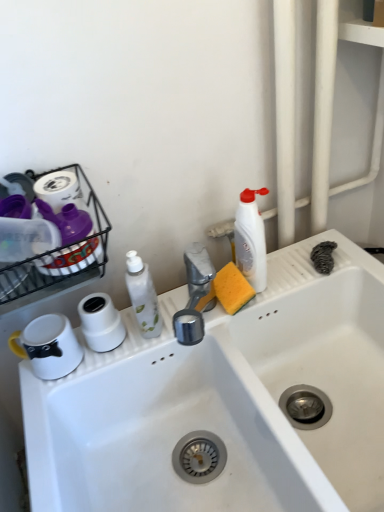
Image resolution: width=384 pixels, height=512 pixels. What do you see at coordinates (225, 401) in the screenshot?
I see `white glossy sink at center` at bounding box center [225, 401].

What are the coordinates of `white glossy mug at left` in the screenshot? It's located at pos(48,346).

The image size is (384, 512). What do you see at coordinates (251, 239) in the screenshot? I see `white plastic bottle at upper right, which is the first cleaning product in right-to-left order` at bounding box center [251, 239].

This screenshot has width=384, height=512. Describe the element at coordinates (101, 322) in the screenshot. I see `white matte toilet paper at center` at that location.

Measure the distance between white glossy bottle at center, which is the 2th cleaning product from right to left, and camera.

white glossy bottle at center, which is the 2th cleaning product from right to left, and camera are 32.55 inches apart.

Identify the location of white glossy sink at center. Image resolution: width=384 pixels, height=512 pixels. (225, 401).

Considering the sizes of objects white matte toilet paper at center and white glossy sink at center in the image provided, who is bigger, white matte toilet paper at center or white glossy sink at center?

white glossy sink at center is bigger.

Is the depth of white matte toilet paper at center greater than that of white glossy sink at center?

Yes, white matte toilet paper at center is further from the viewer.

Find the location of a particular element. The width and height of the screenshot is (384, 512). sink in front of the white matte toilet paper at center is located at coordinates (225, 401).

Based on the photo, which of these two, white matte toilet paper at center or white glossy sink at center, is wider?

With larger width is white glossy sink at center.

Is white glossy sink at center taller or shorter than white glossy bottle at center, marked as the first cleaning product in a left-to-right arrangement?

In the image, white glossy sink at center appears to be taller than white glossy bottle at center, marked as the first cleaning product in a left-to-right arrangement.

Which is behind, white glossy sink at center or white glossy bottle at center, which is the 2th cleaning product from right to left?

white glossy bottle at center, which is the 2th cleaning product from right to left, is more distant.

Is white glossy sink at center next to white glossy bottle at center, which is the 2th cleaning product from right to left, and touching it?

There is a gap between white glossy sink at center and white glossy bottle at center, which is the 2th cleaning product from right to left.

From the image's perspective, which one is positioned lower, white glossy sink at center or white glossy bottle at center, which is the 2th cleaning product from right to left?

white glossy sink at center is shown below in the image.

Is point (57, 321) positioned in front of point (138, 377)?

Yes, it is.

Based on the photo, from the image's perspective, is white glossy mug at left located above or below white glossy sink at center?

white glossy mug at left is above white glossy sink at center.

Is white glossy mug at left directly adjacent to white glossy sink at center?

white glossy mug at left and white glossy sink at center are not in contact.

Which of these two, white glossy mug at left or white glossy sink at center, is bigger?

white glossy sink at center is bigger.

Is white matte toilet paper at center facing away from white plastic bottle at upper right, which is the first cleaning product in right-to-left order?

white matte toilet paper at center is not turned away from white plastic bottle at upper right, which is the first cleaning product in right-to-left order.

Is white matte toilet paper at center not inside white plastic bottle at upper right, which is the second cleaning product in left-to-right order?

Absolutely, white matte toilet paper at center is external to white plastic bottle at upper right, which is the second cleaning product in left-to-right order.

Is point (113, 345) more distant than point (253, 225)?

Yes, it is behind point (253, 225).

From a real-world perspective, is white matte toilet paper at center positioned over white plastic bottle at upper right, which is the first cleaning product in right-to-left order, based on gravity?

No.

Is white glossy mug at left thinner than white glossy bottle at center, marked as the first cleaning product in a left-to-right arrangement?

No.

Is the position of white glossy mug at left more distant than that of white glossy bottle at center, which is the 2th cleaning product from right to left?

Yes, the depth of white glossy mug at left is greater than that of white glossy bottle at center, which is the 2th cleaning product from right to left.

Do you think white glossy mug at left is within white glossy bottle at center, which is the 2th cleaning product from right to left, or outside of it?

white glossy mug at left is not enclosed by white glossy bottle at center, which is the 2th cleaning product from right to left.

Based on the photo, how much distance is there between white plastic bottle at upper right, which is the second cleaning product in left-to-right order, and white glossy sink at center?

A distance of 11.16 inches exists between white plastic bottle at upper right, which is the second cleaning product in left-to-right order, and white glossy sink at center.

Is white plastic bottle at upper right, which is the first cleaning product in right-to-left order, next to white glossy sink at center and touching it?

They are not placed beside each other.

Is white plastic bottle at upper right, which is the second cleaning product in left-to-right order, turned away from white glossy sink at center?

That's not correct — white plastic bottle at upper right, which is the second cleaning product in left-to-right order, is not looking away from white glossy sink at center.

From a real-world perspective, who is located lower, white plastic bottle at upper right, which is the second cleaning product in left-to-right order, or white glossy sink at center?

white glossy sink at center, from a real-world perspective.

Is white matte toilet paper at center aimed at white glossy mug at left?

No, white matte toilet paper at center is not aimed at white glossy mug at left.

Is white matte toilet paper at center far from white glossy mug at left?

No, white matte toilet paper at center is not far away from white glossy mug at left.

Would you say white matte toilet paper at center is inside or outside white glossy mug at left?

white matte toilet paper at center cannot be found inside white glossy mug at left.

Can you confirm if white matte toilet paper at center is thinner than white glossy mug at left?

Correct, the width of white matte toilet paper at center is less than that of white glossy mug at left.

Identify the location of toilet paper behind the white glossy sink at center. (101, 322).

The width and height of the screenshot is (384, 512). Find the location of `the 1st cleaning product above the white glossy sink at center (from a real-world perspective)`. the 1st cleaning product above the white glossy sink at center (from a real-world perspective) is located at coordinates (143, 296).

Considering their positions, is white glossy bottle at center, marked as the first cleaning product in a left-to-right arrangement, positioned further to white glossy sink at center than white matte toilet paper at center?

white matte toilet paper at center is positioned further to the anchor white glossy sink at center.

When comparing their distances from white glossy sink at center, does white matte toilet paper at center or white plastic bottle at upper right, which is the first cleaning product in right-to-left order, seem further?

white matte toilet paper at center lies further to white glossy sink at center than the other object.

From the image, which object appears to be nearer to white matte toilet paper at center, white glossy sink at center or white glossy bottle at center, marked as the first cleaning product in a left-to-right arrangement?

white glossy bottle at center, marked as the first cleaning product in a left-to-right arrangement, is positioned closer to the anchor white matte toilet paper at center.

Estimate the real-world distances between objects in this image. Which object is closer to white glossy bottle at center, which is the 2th cleaning product from right to left, white glossy mug at left or white glossy sink at center?

Among the two, white glossy mug at left is located nearer to white glossy bottle at center, which is the 2th cleaning product from right to left.

Looking at the image, which one is located further to white glossy sink at center, white plastic bottle at upper right, which is the first cleaning product in right-to-left order, or white matte toilet paper at center?

white matte toilet paper at center is positioned further to the anchor white glossy sink at center.

Considering their positions, is white glossy mug at left positioned further to white glossy sink at center than white matte toilet paper at center?

white glossy mug at left lies further to white glossy sink at center than the other object.

Looking at the image, which one is located further to white matte toilet paper at center, white glossy mug at left or white plastic bottle at upper right, which is the first cleaning product in right-to-left order?

white plastic bottle at upper right, which is the first cleaning product in right-to-left order, is positioned further to the anchor white matte toilet paper at center.

Looking at the image, which one is located further to white plastic bottle at upper right, which is the second cleaning product in left-to-right order, white glossy sink at center or white matte toilet paper at center?

Among the two, white matte toilet paper at center is located further to white plastic bottle at upper right, which is the second cleaning product in left-to-right order.

Where is `sink located between white glossy mug at left and white plastic bottle at upper right, which is the first cleaning product in right-to-left order, in the left-right direction`? The width and height of the screenshot is (384, 512). sink located between white glossy mug at left and white plastic bottle at upper right, which is the first cleaning product in right-to-left order, in the left-right direction is located at coordinates (225, 401).

The image size is (384, 512). Identify the location of cleaning product between white glossy sink at center and white plastic bottle at upper right, which is the second cleaning product in left-to-right order, in the front-back direction. (143, 296).

Image resolution: width=384 pixels, height=512 pixels. In order to click on toilet paper between white glossy mug at left and white glossy sink at center from left to right in this screenshot , I will do `click(101, 322)`.

The width and height of the screenshot is (384, 512). Find the location of `cleaning product located between white matte toilet paper at center and white plastic bottle at upper right, which is the second cleaning product in left-to-right order, in the left-right direction`. cleaning product located between white matte toilet paper at center and white plastic bottle at upper right, which is the second cleaning product in left-to-right order, in the left-right direction is located at coordinates (143, 296).